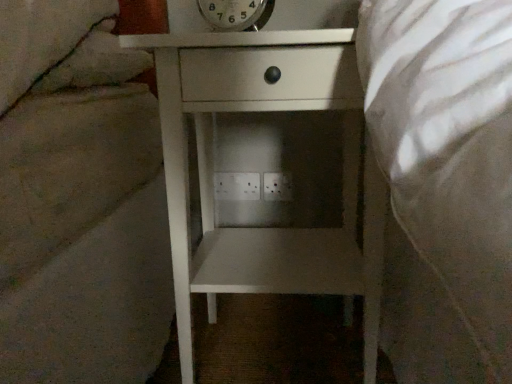
Question: Is white matte nightstand at center wider or thinner than white plastic electric outlet at center, positioned as the second electric outlet in right-to-left order?

Choices:
 (A) wide
 (B) thin

Answer: (A)

Question: Based on their positions, is white matte nightstand at center located to the left or right of white plastic electric outlet at center, positioned as the second electric outlet in right-to-left order?

Choices:
 (A) left
 (B) right

Answer: (B)

Question: Which of these objects is positioned closest to the white plastic electric outlet at center, arranged as the 2th electric outlet when viewed from the left?

Choices:
 (A) metallic silver clock at upper center
 (B) white matte nightstand at center
 (C) white plastic electric outlet at center, which is the 1th electric outlet in left-to-right order

Answer: (C)

Question: Estimate the real-world distances between objects in this image. Which object is farther from the white plastic electric outlet at center, positioned as the second electric outlet in right-to-left order?

Choices:
 (A) metallic silver clock at upper center
 (B) white plastic electric outlet at center, arranged as the 2th electric outlet when viewed from the left
 (C) white matte nightstand at center

Answer: (A)